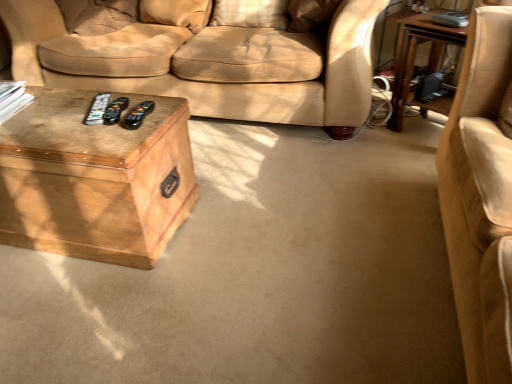
Question: In terms of width, does wooden trunk at lower left, acting as the first table starting from the left, look wider or thinner when compared to wooden table at right, the second table when ordered from left to right?

Choices:
 (A) thin
 (B) wide

Answer: (B)

Question: From the image's perspective, is wooden trunk at lower left, acting as the first table starting from the left, located above or below wooden table at right, arranged as the first table when viewed from the right?

Choices:
 (A) above
 (B) below

Answer: (B)

Question: Based on their relative distances, which object is farther from the wooden table at right, the second table when ordered from left to right?

Choices:
 (A) black plastic remote at center, arranged as the 2th remote when viewed from the right
 (B) black plastic remote at center, marked as the 3th remote in a right-to-left arrangement
 (C) black plastic remote at center, the 3th remote in the left-to-right sequence
 (D) wooden trunk at lower left, which is the second table in right-to-left order

Answer: (B)

Question: Estimate the real-world distances between objects in this image. Which object is closer to the wooden table at right, the second table when ordered from left to right?

Choices:
 (A) black plastic remote at center, marked as the 3th remote in a right-to-left arrangement
 (B) black plastic remote at center, the 2th remote viewed from the left
 (C) black plastic remote at center, which is counted as the first remote, starting from the right
 (D) wooden trunk at lower left, acting as the first table starting from the left

Answer: (C)